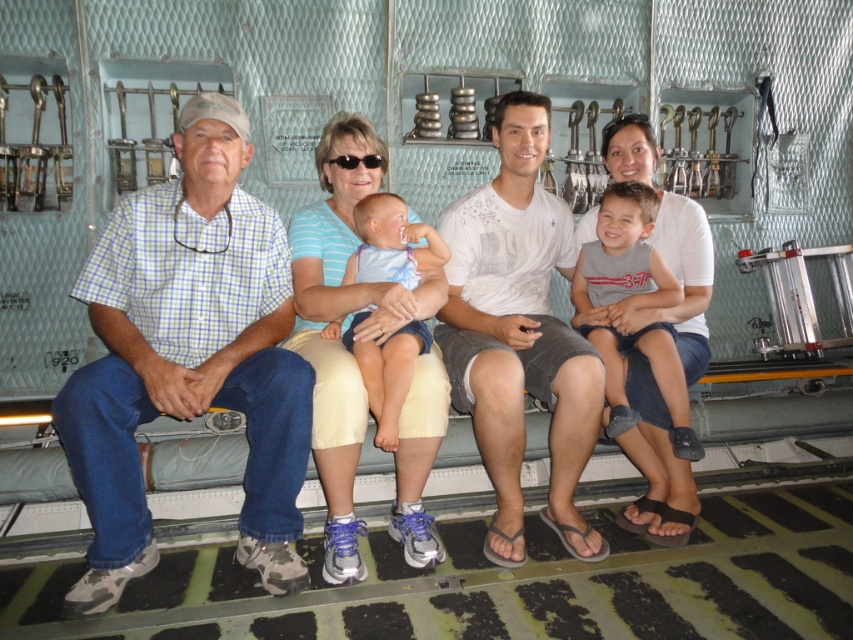
Is white cotton shirt at center above gray cotton shirt at center?

Actually, white cotton shirt at center is below gray cotton shirt at center.

Who is shorter, white cotton shirt at center or gray cotton shirt at center?

gray cotton shirt at center is shorter.

Is point (543, 349) closer to viewer compared to point (616, 257)?

Yes, it is in front of point (616, 257).

Identify the location of white cotton shirt at center. (518, 333).

Does point (482, 205) lie behind point (331, 323)?

That is True.

Between white cotton shirt at center and light blue fabric baby at center, which one has more height?

white cotton shirt at center is taller.

In order to click on white cotton shirt at center in this screenshot , I will do `click(518, 333)`.

Does point (490, 472) come farther from viewer compared to point (561, 499)?

No, it is in front of (561, 499).

Measure the distance between point (x=125, y=266) and camera.

A distance of 2.52 meters exists between point (x=125, y=266) and camera.

What do you see at coordinates (212, 362) in the screenshot?
I see `matte white shirt at center` at bounding box center [212, 362].

This screenshot has width=853, height=640. Find the location of `matte white shirt at center`. matte white shirt at center is located at coordinates (212, 362).